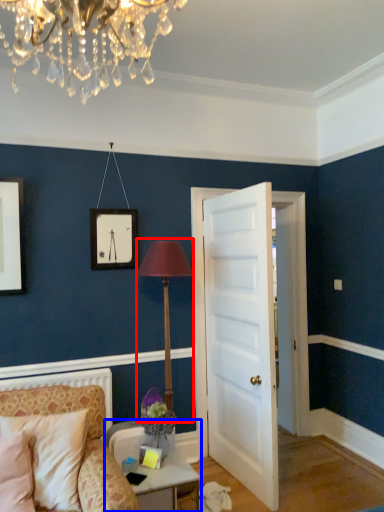
Question: Which of the following is the closest to the observer, table lamp (highlighted by a red box) or table (highlighted by a blue box)?

Choices:
 (A) table lamp
 (B) table

Answer: (B)